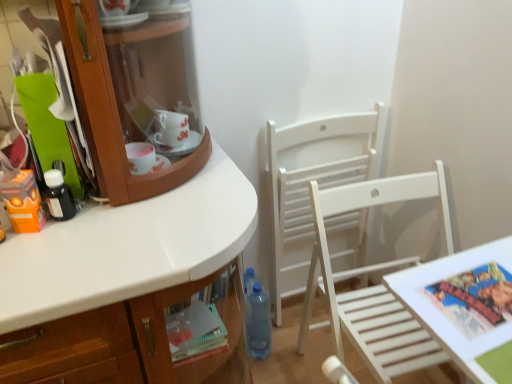
Question: Is white wood chair at center, which is the 1th chair from back to front, wider or thinner than orange matte toy at left?

Choices:
 (A) wide
 (B) thin

Answer: (A)

Question: From the image's perspective, is white wood chair at center, which is the 1th chair from back to front, positioned above or below orange matte toy at left?

Choices:
 (A) below
 (B) above

Answer: (A)

Question: Considering the real-world distances, which object is closest to the white wood chair at center, the second chair in the back-to-front sequence?

Choices:
 (A) printed paper comic book at lower right
 (B) orange matte toy at left
 (C) blue translucent bottle at lower center, the first bottle from the right
 (D) white wooden table at lower right
 (E) black matte bottle at left, the 1th bottle positioned from the left

Answer: (D)

Question: Estimate the real-world distances between objects in this image. Which object is closer to the orange matte toy at left?

Choices:
 (A) white wood chair at center, which is counted as the second chair, starting from the front
 (B) blue translucent bottle at lower center, the first bottle from the right
 (C) black matte bottle at left, the 1th bottle when ordered from top to bottom
 (D) white wood chair at center, acting as the 1th chair starting from the front
 (E) white wooden table at lower right

Answer: (C)